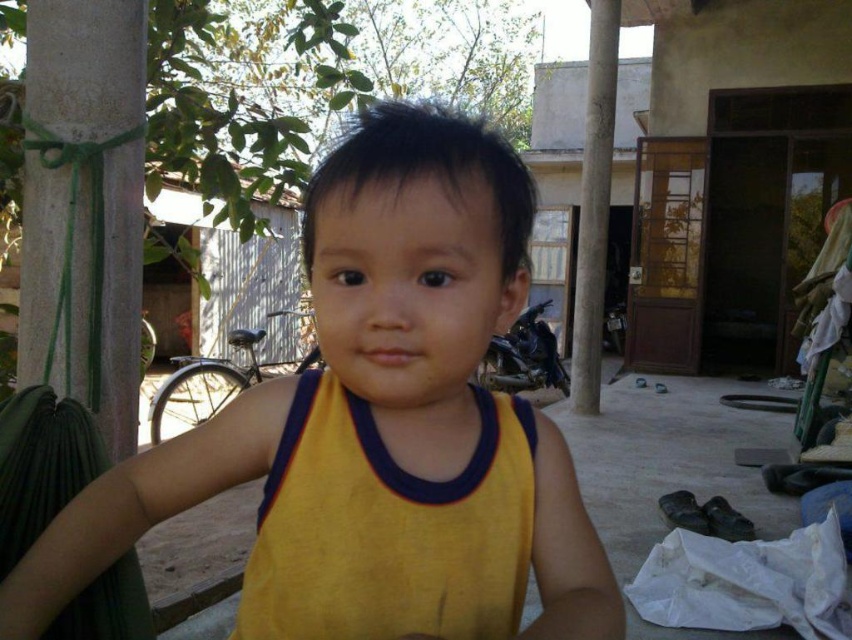
Question: Is yellow fabric at center wider than yellow fabric vest at center?

Choices:
 (A) yes
 (B) no

Answer: (A)

Question: Which point appears farthest from the camera in this image?

Choices:
 (A) (295, 442)
 (B) (557, 612)

Answer: (A)

Question: Which point is farther from the camera taking this photo?

Choices:
 (A) (380, 136)
 (B) (504, 600)

Answer: (B)

Question: Does yellow fabric at center have a larger size compared to yellow fabric vest at center?

Choices:
 (A) yes
 (B) no

Answer: (A)

Question: Can you confirm if yellow fabric at center is positioned to the right of yellow fabric vest at center?

Choices:
 (A) yes
 (B) no

Answer: (B)